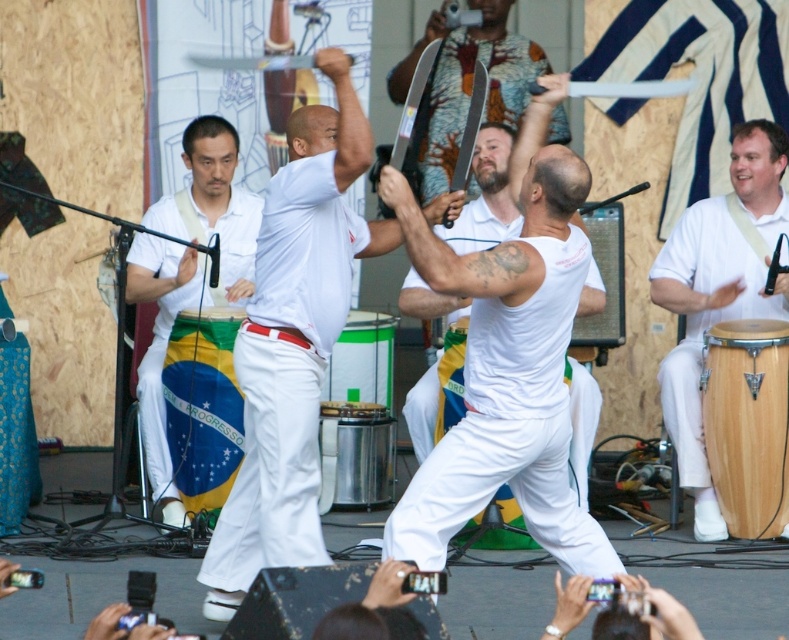
You are a performer carrying a 2 meter long pole. You need to move from the white wood drum at right to the white wooden drum at center. Can you pass through the space between them without tilting the pole?

The distance between the white wood drum at right and the white wooden drum at center is 1.95 meters. Since the pole is 2 meters long, it is slightly longer than the available space. Therefore, you cannot pass through the space between them without tilting the pole.

Consider the image. You are a photographer at the event and want to capture a photo that includes both the white wood drum at right and the green metallic drum at center. Based on their positions, which drum should be placed on the left side of the photo to ensure both are in frame?

The green metallic drum at center should be placed on the left side of the photo because the white wood drum at right is to the right of it, so positioning the green metallic drum at center on the left would allow both drums to be captured in the frame.